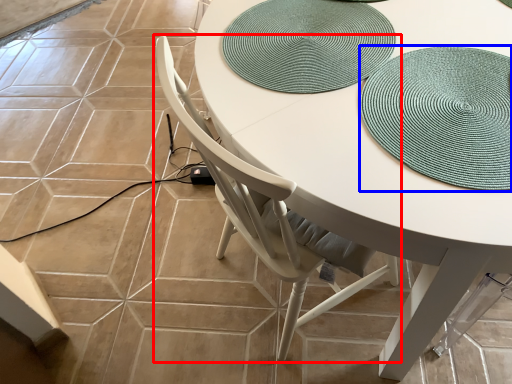
Question: Which object appears closest to the camera in this image, chair (highlighted by a red box) or hat (highlighted by a blue box)?

Choices:
 (A) chair
 (B) hat

Answer: (A)